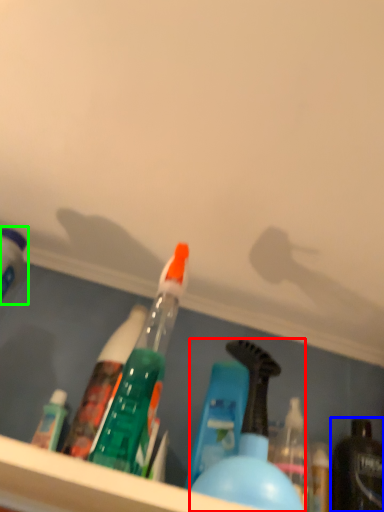
Question: Estimate the real-world distances between objects in this image. Which object is closer to bottle (highlighted by a red box), bottle (highlighted by a blue box) or bottle (highlighted by a green box)?

Choices:
 (A) bottle
 (B) bottle

Answer: (A)